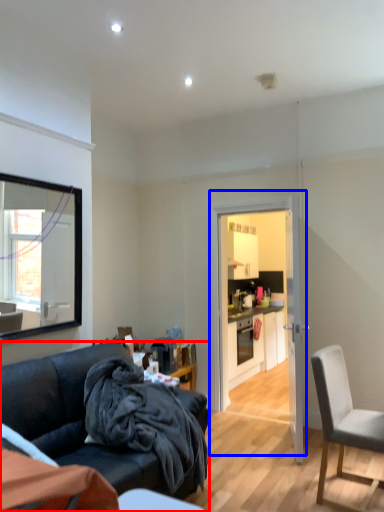
Question: Which object is closer to the camera taking this photo, studio couch (highlighted by a red box) or door (highlighted by a blue box)?

Choices:
 (A) studio couch
 (B) door

Answer: (A)